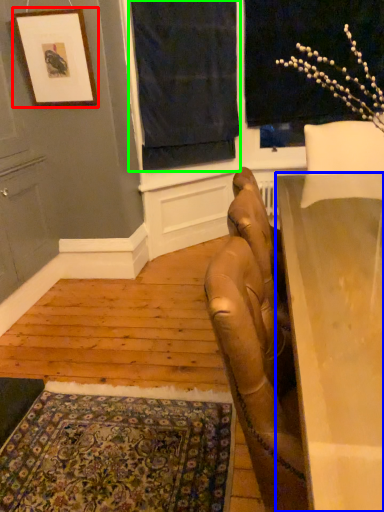
Question: Considering the real-world distances, which object is farthest from picture frame (highlighted by a red box)? table (highlighted by a blue box) or curtain (highlighted by a green box)?

Choices:
 (A) table
 (B) curtain

Answer: (A)